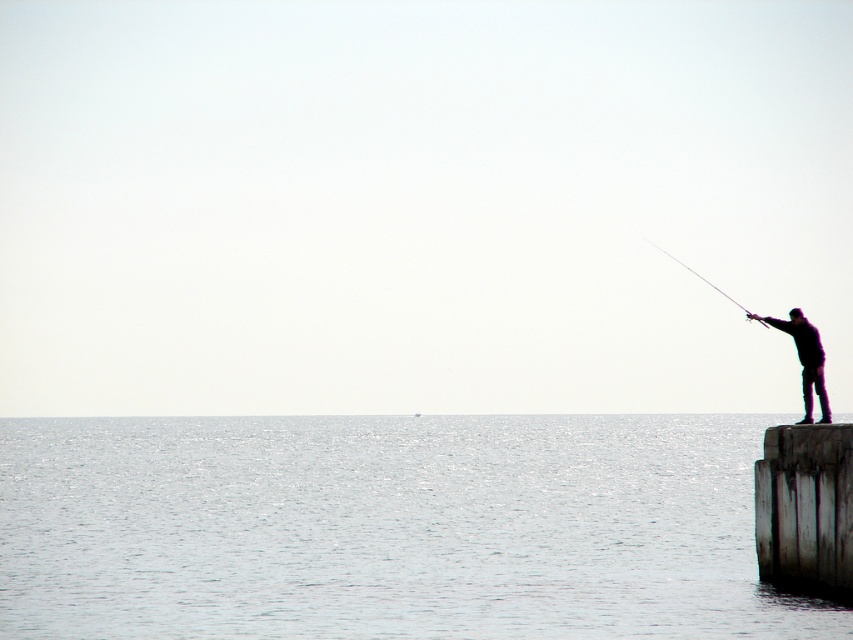
Question: Which of the following is the farthest from the observer?

Choices:
 (A) (838, 480)
 (B) (817, 387)
 (C) (247, 445)

Answer: (C)

Question: Which object is the closest to the dark matte clothing at right?

Choices:
 (A) shiny blue water at lower left
 (B) weathered wood dock at right

Answer: (B)

Question: Does dark matte clothing at right appear under smooth black rod at right?

Choices:
 (A) no
 (B) yes

Answer: (B)

Question: Among these points, which one is nearest to the camera?

Choices:
 (A) (824, 392)
 (B) (851, 566)

Answer: (B)

Question: Is the position of shiny blue water at lower left more distant than that of dark matte clothing at right?

Choices:
 (A) yes
 (B) no

Answer: (B)

Question: Does weathered wood dock at right have a lesser width compared to smooth black rod at right?

Choices:
 (A) no
 (B) yes

Answer: (B)